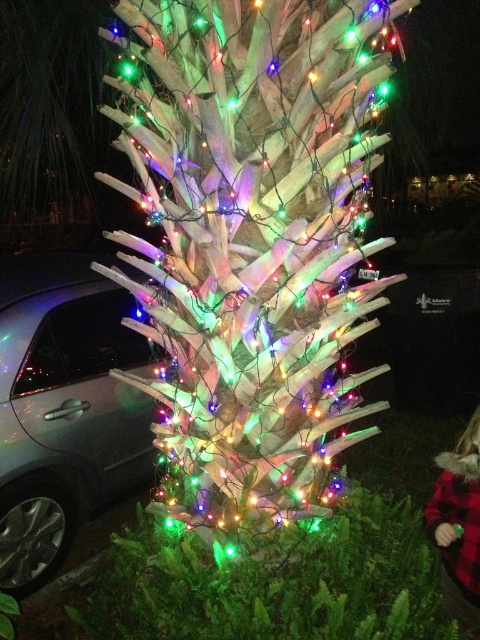
Question: Does iridescent white lights at center appear under satin silver car at left?

Choices:
 (A) yes
 (B) no

Answer: (B)

Question: Considering the real-world distances, which object is closest to the satin silver car at left?

Choices:
 (A) red plaid coat at lower right
 (B) iridescent white lights at center

Answer: (B)

Question: Can you confirm if satin silver car at left is positioned to the left of red plaid coat at lower right?

Choices:
 (A) yes
 (B) no

Answer: (A)

Question: Is iridescent white lights at center positioned behind satin silver car at left?

Choices:
 (A) no
 (B) yes

Answer: (A)

Question: Which point appears closest to the camera in this image?

Choices:
 (A) (338, 208)
 (B) (428, 516)
 (C) (23, 548)

Answer: (A)

Question: Among these points, which one is nearest to the camera?

Choices:
 (A) (55, 429)
 (B) (456, 561)

Answer: (B)